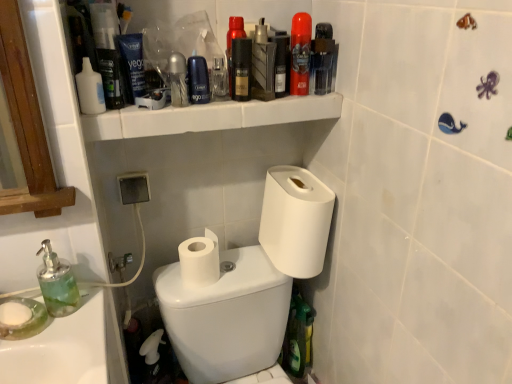
Question: Is white matte toilet paper at center, placed as the second toilet paper when sorted from right to left, far from blue matte tube at upper center, which is the 8th mouthwash in right-to-left order?

Choices:
 (A) yes
 (B) no

Answer: (B)

Question: From the image's perspective, is white matte toilet paper at center, acting as the first toilet paper starting from the left, on blue matte tube at upper center, which is the 8th mouthwash in right-to-left order?

Choices:
 (A) yes
 (B) no

Answer: (B)

Question: Is blue matte tube at upper center, which is the 8th mouthwash in right-to-left order, located within white matte toilet paper at center, placed as the second toilet paper when sorted from right to left?

Choices:
 (A) no
 (B) yes

Answer: (A)

Question: Is white matte toilet paper at center, placed as the second toilet paper when sorted from right to left, beside blue matte tube at upper center, the second mouthwash in the left-to-right sequence?

Choices:
 (A) no
 (B) yes

Answer: (A)

Question: Is white matte toilet paper at center, placed as the second toilet paper when sorted from right to left, outside of blue matte tube at upper center, the second mouthwash in the left-to-right sequence?

Choices:
 (A) yes
 (B) no

Answer: (A)

Question: Does white matte toilet paper at center, acting as the first toilet paper starting from the left, have a lesser height compared to blue matte tube at upper center, the second mouthwash in the left-to-right sequence?

Choices:
 (A) yes
 (B) no

Answer: (A)

Question: Is white plastic bidet at lower right far from green glass soap dispenser at lower left?

Choices:
 (A) no
 (B) yes

Answer: (A)

Question: Is the surface of white plastic bidet at lower right in direct contact with green glass soap dispenser at lower left?

Choices:
 (A) no
 (B) yes

Answer: (A)

Question: From the image's perspective, would you say white plastic bidet at lower right is positioned over green glass soap dispenser at lower left?

Choices:
 (A) no
 (B) yes

Answer: (A)

Question: Is the position of white plastic bidet at lower right more distant than that of green glass soap dispenser at lower left?

Choices:
 (A) no
 (B) yes

Answer: (B)

Question: Is white plastic bidet at lower right wider than green glass soap dispenser at lower left?

Choices:
 (A) yes
 (B) no

Answer: (A)

Question: Is white plastic bidet at lower right thinner than green glass soap dispenser at lower left?

Choices:
 (A) no
 (B) yes

Answer: (A)

Question: From a real-world perspective, is matte black bottle at center, positioned as the fifth mouthwash in right-to-left order, on top of blue matte tube at upper center, the second mouthwash in the left-to-right sequence?

Choices:
 (A) yes
 (B) no

Answer: (B)